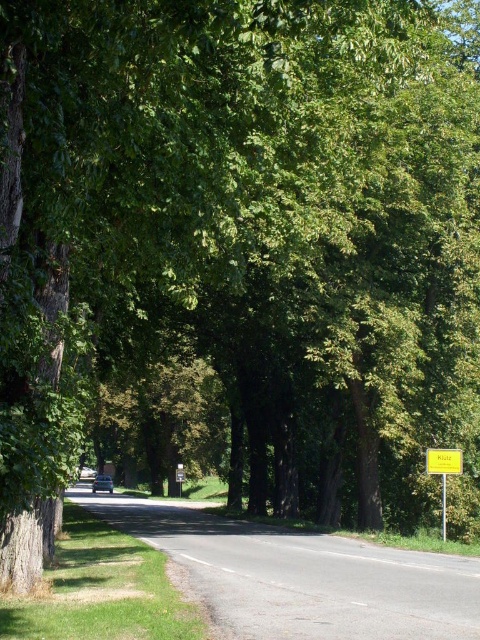
You are driving a car and see the yellow plastic sign at right and the metallic silver car at center. Which object is closer to you?

The yellow plastic sign at right is closer to you because it is in front of the metallic silver car at center.